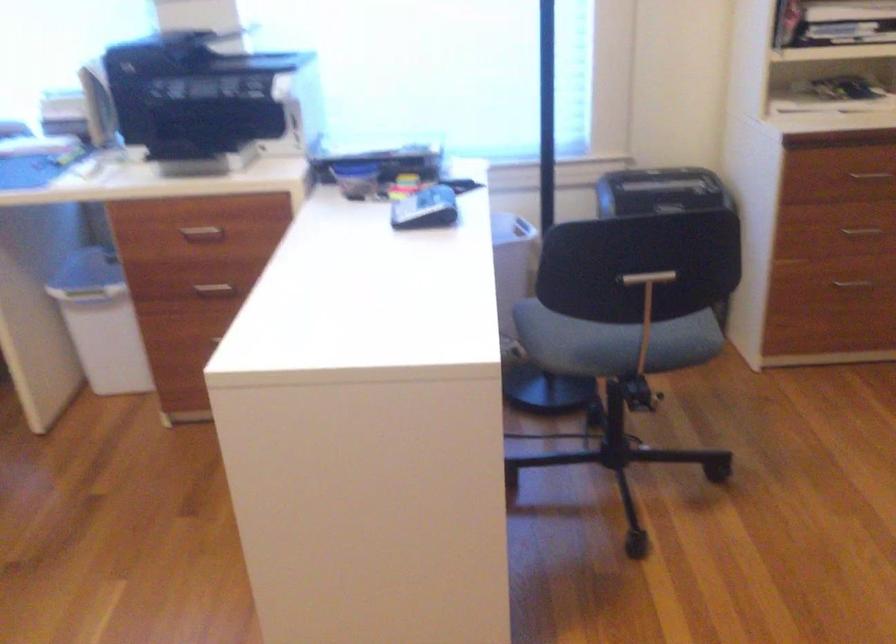
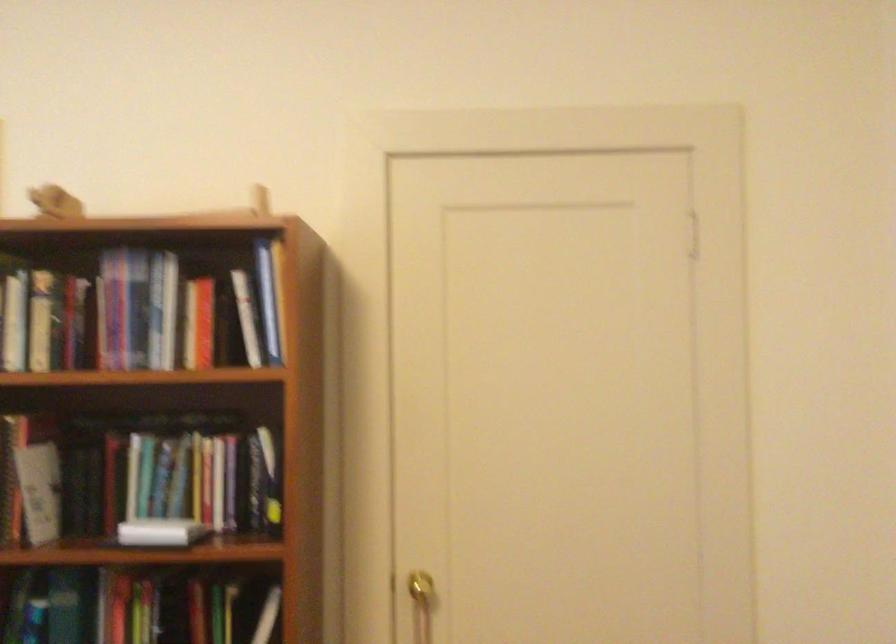
Question: Based on the continuous images, in which direction is the camera rotating? Reply with the corresponding letter.

Choices:
 (A) Left
 (B) Right
 (C) Up
 (D) Down

Answer: (B)